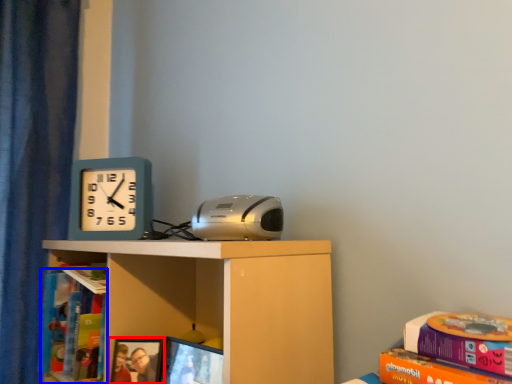
Question: Which point is closer to the camera, picture frame (highlighted by a red box) or book (highlighted by a blue box)?

Choices:
 (A) picture frame
 (B) book

Answer: (A)